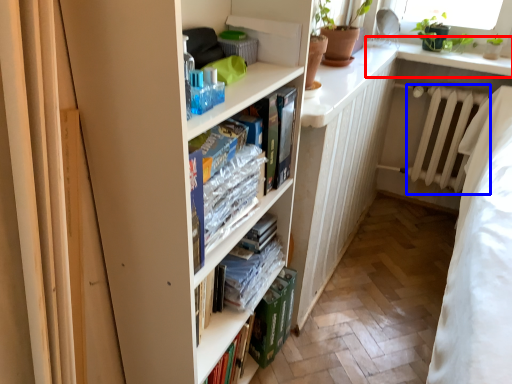
Question: Which object is closer to the camera taking this photo, window sill (highlighted by a red box) or radiator (highlighted by a blue box)?

Choices:
 (A) window sill
 (B) radiator

Answer: (A)